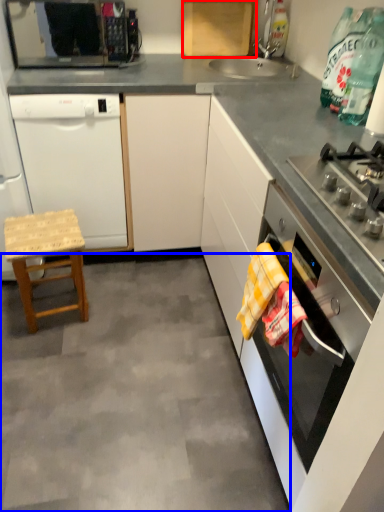
Question: Which object appears farthest to the camera in this image, cabinetry (highlighted by a red box) or concrete (highlighted by a blue box)?

Choices:
 (A) cabinetry
 (B) concrete

Answer: (A)